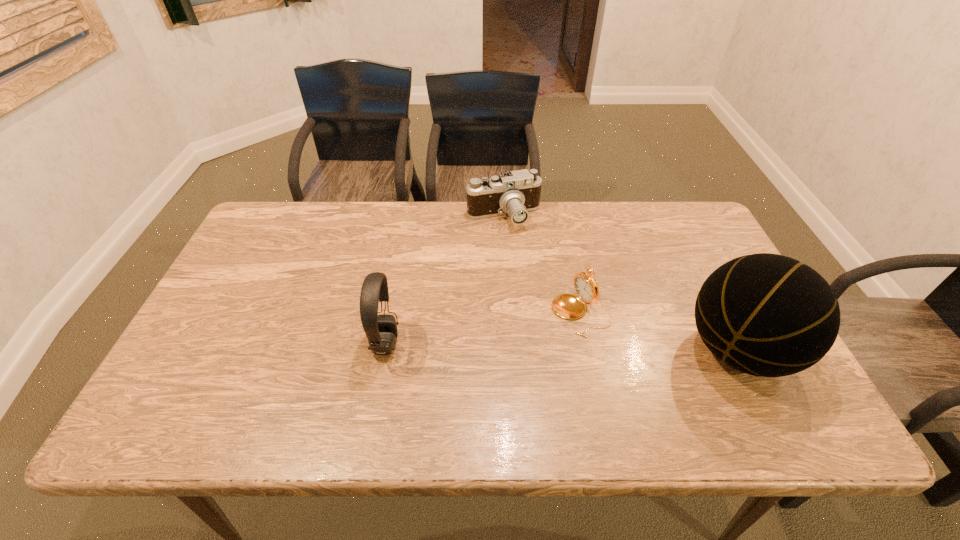
Locate an element on the screen. The height and width of the screenshot is (540, 960). free spot between the headset and the pocket watch is located at coordinates [483, 328].

Identify the location of free spot between the pocket watch and the farthest object. (542, 265).

The width and height of the screenshot is (960, 540). In order to click on vacant region between the leftmost object and the pocket watch in this screenshot , I will do `click(483, 328)`.

At what (x,y) coordinates should I click in order to perform the action: click on vacant area that lies between the pocket watch and the tallest object. Please return your answer as a coordinate pair (x, y). This screenshot has height=540, width=960. Looking at the image, I should click on (660, 332).

Identify which object is the nearest to the farthest object. Please provide its 2D coordinates. Your answer should be formatted as a tuple, i.e. [(x, y)], where the tuple contains the x and y coordinates of a point satisfying the conditions above.

[(568, 306)]

This screenshot has width=960, height=540. In order to click on object that is the closest to the farthest object in this screenshot , I will do `click(568, 306)`.

The image size is (960, 540). Identify the location of vacant space that satisfies the following two spatial constraints: 1. on the front side of the camera; 2. on the right side of the pocket watch. (510, 313).